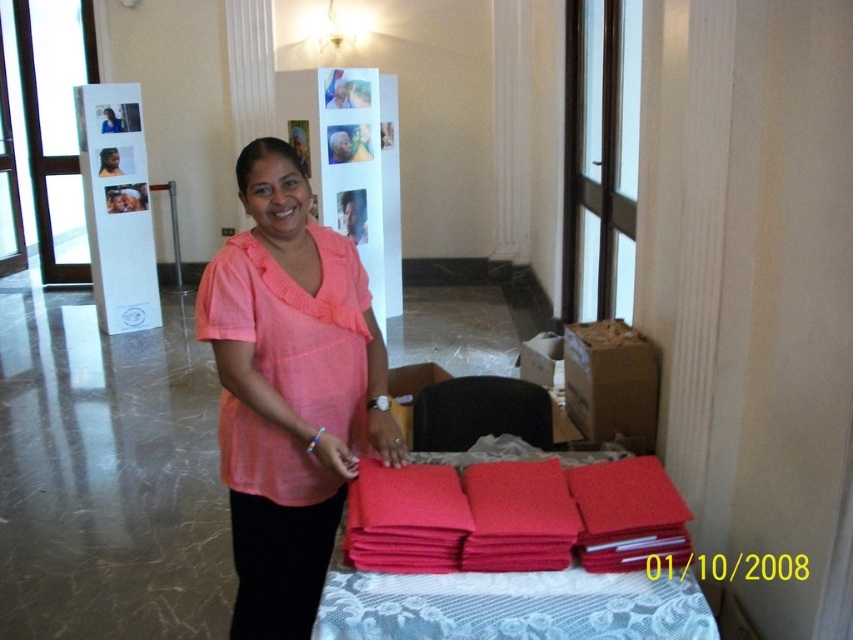
You are organizing an event and need to know which object takes up more space in the image. Which is larger in size between the pink cotton shirt at center and the matte red folder at lower center?

The pink cotton shirt at center is larger in size than the matte red folder at lower center.